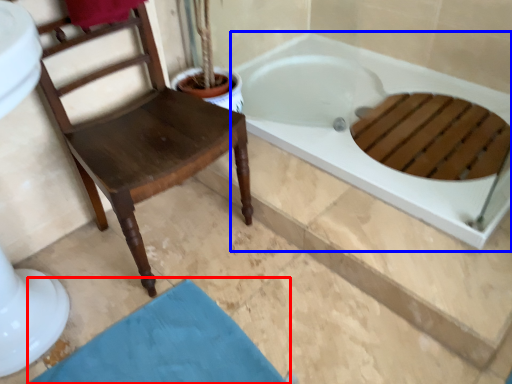
Question: Which point is further to the camera, bath mat (highlighted by a red box) or bathtub (highlighted by a blue box)?

Choices:
 (A) bath mat
 (B) bathtub

Answer: (B)